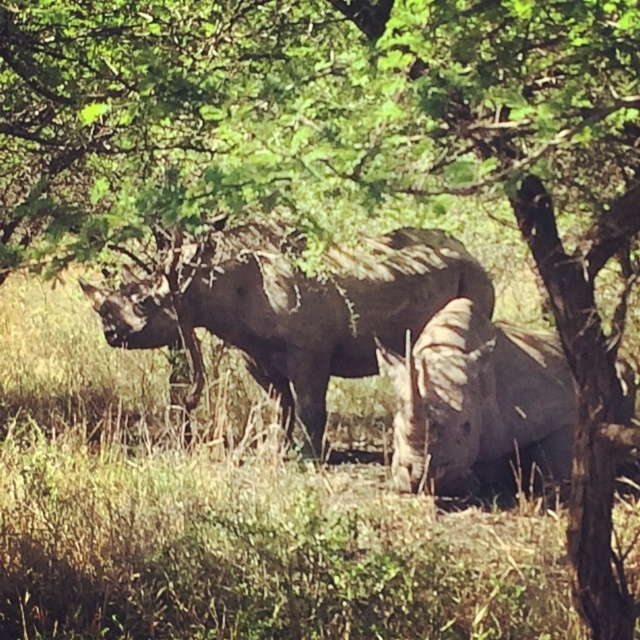
Question: From the image, what is the correct spatial relationship of dark gray textured rhino at center in relation to gray matte rhinoceros at center?

Choices:
 (A) left
 (B) right

Answer: (A)

Question: Is dark gray textured rhino at center closer to the viewer compared to gray matte rhinoceros at center?

Choices:
 (A) no
 (B) yes

Answer: (A)

Question: Is dark gray textured rhino at center further to the viewer compared to gray matte rhinoceros at center?

Choices:
 (A) yes
 (B) no

Answer: (A)